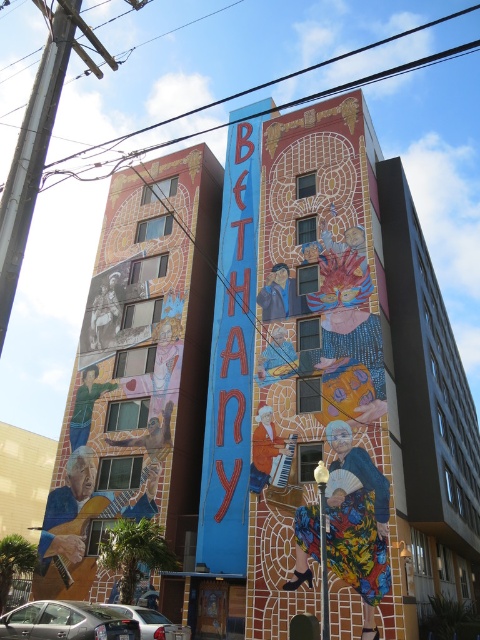
You are a painter standing on a ladder to touch up the mural. You need to reach both the multicolored mosaic at left and the silver metallic car at lower left. Which object will require you to climb higher on the ladder?

The multicolored mosaic at left is bigger than the silver metallic car at lower left, so you will need to climb higher on the ladder to reach the multicolored mosaic at left.

You are standing in front of the mural and want to touch the point at coordinates point (x=162, y=308). Can you reach it without any tools?

The point (x=162, y=308) is 50.52 meters away from the camera, so it is too far to reach without any tools.